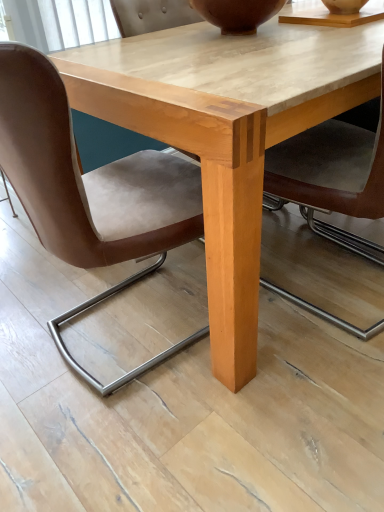
At what (x,y) coordinates should I click in order to perform the action: click on vacant area situated below brown matte vase at upper center (from a real-world perspective). Please return your answer as a coordinate pair (x, y). Looking at the image, I should click on (238, 33).